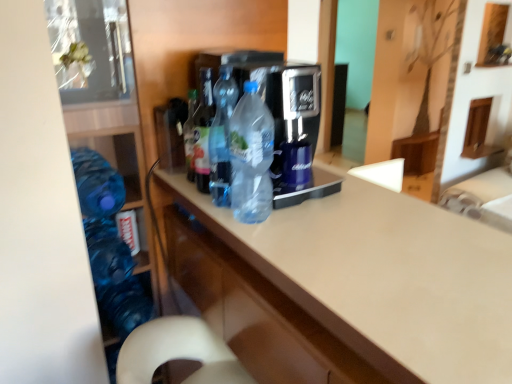
Question: From the image's perspective, is translucent plastic bottle at center, the 2th bottle viewed from the right, on top of translucent plastic bottle at center, the 2th bottle when ordered from left to right?

Choices:
 (A) no
 (B) yes

Answer: (A)

Question: Considering the relative sizes of translucent plastic bottle at center, the third bottle when ordered from left to right, and translucent plastic bottle at center, arranged as the third bottle when viewed from the right, in the image provided, is translucent plastic bottle at center, the third bottle when ordered from left to right, thinner than translucent plastic bottle at center, arranged as the third bottle when viewed from the right,?

Choices:
 (A) no
 (B) yes

Answer: (A)

Question: Is translucent plastic bottle at center, arranged as the third bottle when viewed from the right, inside translucent plastic bottle at center, the third bottle when ordered from left to right?

Choices:
 (A) no
 (B) yes

Answer: (A)

Question: Is translucent plastic bottle at center, the 2th bottle viewed from the right, positioned behind translucent plastic bottle at center, the 2th bottle when ordered from left to right?

Choices:
 (A) no
 (B) yes

Answer: (A)

Question: Is translucent plastic bottle at center, the third bottle when ordered from left to right, taller than translucent plastic bottle at center, the 2th bottle when ordered from left to right?

Choices:
 (A) no
 (B) yes

Answer: (B)

Question: From their relative heights in the image, would you say beige laminate countertop at center is taller or shorter than translucent plastic bottle at center, placed as the first bottle when sorted from right to left?

Choices:
 (A) tall
 (B) short

Answer: (A)

Question: In terms of width, does beige laminate countertop at center look wider or thinner when compared to translucent plastic bottle at center, placed as the first bottle when sorted from right to left?

Choices:
 (A) wide
 (B) thin

Answer: (A)

Question: Which is correct: beige laminate countertop at center is inside translucent plastic bottle at center, placed as the first bottle when sorted from right to left, or outside of it?

Choices:
 (A) outside
 (B) inside

Answer: (A)

Question: From the image's perspective, is beige laminate countertop at center above or below translucent plastic bottle at center, placed as the first bottle when sorted from right to left?

Choices:
 (A) below
 (B) above

Answer: (A)

Question: Considering the positions of translucent plastic bottle at center, arranged as the third bottle when viewed from the right, and beige laminate countertop at center in the image, is translucent plastic bottle at center, arranged as the third bottle when viewed from the right, bigger or smaller than beige laminate countertop at center?

Choices:
 (A) small
 (B) big

Answer: (A)

Question: From their relative heights in the image, would you say translucent plastic bottle at center, the 2th bottle when ordered from left to right, is taller or shorter than beige laminate countertop at center?

Choices:
 (A) short
 (B) tall

Answer: (A)

Question: In terms of width, does translucent plastic bottle at center, arranged as the third bottle when viewed from the right, look wider or thinner when compared to beige laminate countertop at center?

Choices:
 (A) wide
 (B) thin

Answer: (B)

Question: Is translucent plastic bottle at center, the 2th bottle when ordered from left to right, in front of or behind beige laminate countertop at center in the image?

Choices:
 (A) front
 (B) behind

Answer: (B)

Question: Is point (239, 193) closer or farther from the camera than point (95, 163)?

Choices:
 (A) closer
 (B) farther

Answer: (A)

Question: Relative to blue translucent bottle at lower left, which appears as the fourth bottle when viewed from the right, is translucent plastic bottle at center, which appears as the 4th bottle when viewed from the left, in front or behind?

Choices:
 (A) behind
 (B) front

Answer: (B)